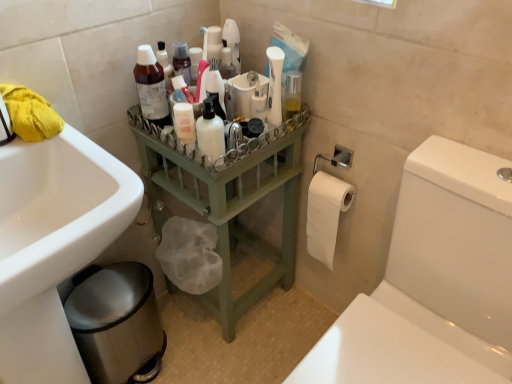
Question: Can you confirm if white glossy sink at lower left is wider than white matte lotion bottle at center?

Choices:
 (A) no
 (B) yes

Answer: (B)

Question: Is white glossy sink at lower left facing towards white matte lotion bottle at center?

Choices:
 (A) no
 (B) yes

Answer: (A)

Question: Is white glossy sink at lower left bigger than white matte lotion bottle at center?

Choices:
 (A) no
 (B) yes

Answer: (B)

Question: Is white glossy sink at lower left touching white matte lotion bottle at center?

Choices:
 (A) yes
 (B) no

Answer: (B)

Question: Can you confirm if white glossy sink at lower left is taller than white matte lotion bottle at center?

Choices:
 (A) yes
 (B) no

Answer: (A)

Question: Does white glossy sink at lower left come behind white matte lotion bottle at center?

Choices:
 (A) no
 (B) yes

Answer: (A)

Question: Considering the relative sizes of translucent plastic bottle at upper center, arranged as the 1th cleaning product when viewed from the left, and yellow fabric at upper left in the image provided, is translucent plastic bottle at upper center, arranged as the 1th cleaning product when viewed from the left, bigger than yellow fabric at upper left?

Choices:
 (A) no
 (B) yes

Answer: (A)

Question: Is translucent plastic bottle at upper center, which is the 3th cleaning product in right-to-left order, wider than yellow fabric at upper left?

Choices:
 (A) yes
 (B) no

Answer: (B)

Question: Does translucent plastic bottle at upper center, arranged as the 1th cleaning product when viewed from the left, appear on the right side of yellow fabric at upper left?

Choices:
 (A) no
 (B) yes

Answer: (B)

Question: Is translucent plastic bottle at upper center, arranged as the 1th cleaning product when viewed from the left, positioned beyond the bounds of yellow fabric at upper left?

Choices:
 (A) no
 (B) yes

Answer: (B)

Question: Is translucent plastic bottle at upper center, arranged as the 1th cleaning product when viewed from the left, behind yellow fabric at upper left?

Choices:
 (A) yes
 (B) no

Answer: (A)

Question: Is translucent plastic bottle at upper center, which is the 3th cleaning product in right-to-left order, to the left of yellow fabric at upper left from the viewer's perspective?

Choices:
 (A) no
 (B) yes

Answer: (A)

Question: Could you tell me if white glossy toilet at right is facing white matte pump bottle at center, which appears as the 2th cleaning product when viewed from the right?

Choices:
 (A) no
 (B) yes

Answer: (A)